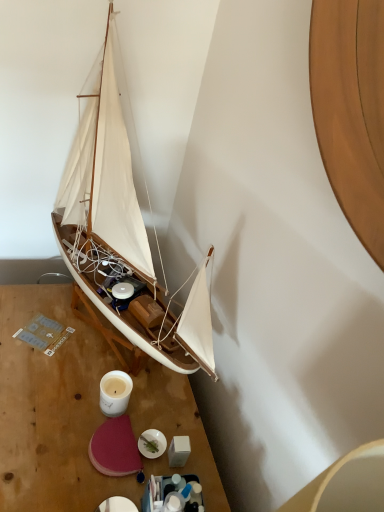
The height and width of the screenshot is (512, 384). What do you see at coordinates (52, 410) in the screenshot?
I see `wooden table at lower left` at bounding box center [52, 410].

The image size is (384, 512). I want to click on wooden table at lower left, so click(x=52, y=410).

The width and height of the screenshot is (384, 512). Identify the location of wooden table at lower left. (52, 410).